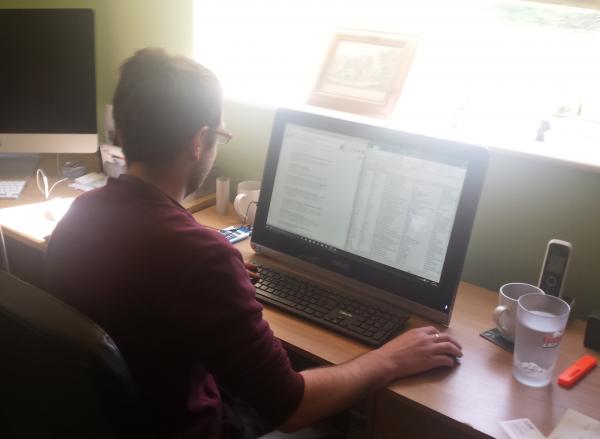
Where is `glass of water`? This screenshot has width=600, height=439. glass of water is located at coordinates (542, 357).